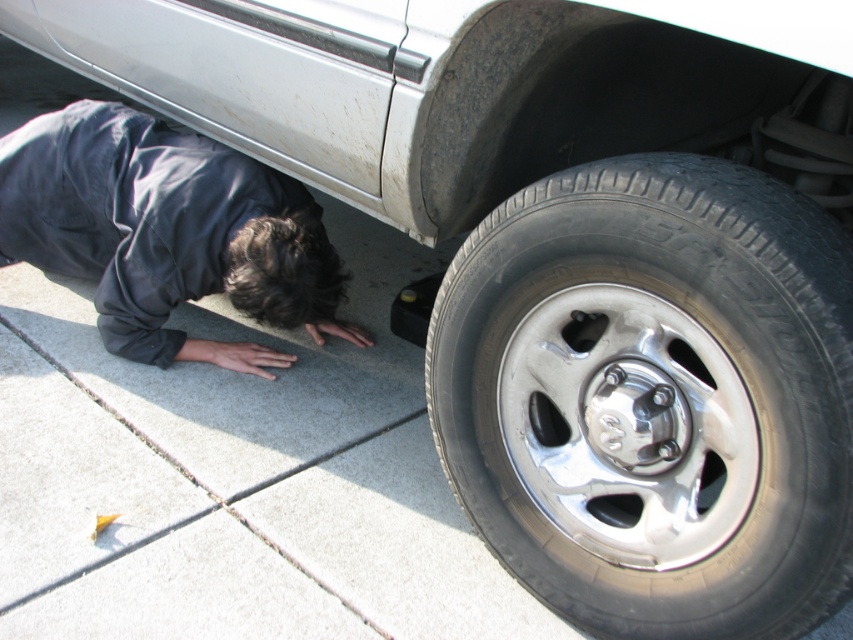
Is polished silver wheel at lower right bigger than silver metallic rim at lower right?

Yes, polished silver wheel at lower right is bigger than silver metallic rim at lower right.

Which is more to the left, polished silver wheel at lower right or silver metallic rim at lower right?

polished silver wheel at lower right

Image resolution: width=853 pixels, height=640 pixels. What do you see at coordinates (654, 397) in the screenshot? I see `polished silver wheel at lower right` at bounding box center [654, 397].

You are a GUI agent. You are given a task and a screenshot of the screen. Output one action in this format:
    pyautogui.click(x=<x>, y=<y>)
    Task: Click on the polished silver wheel at lower right
    Image resolution: width=853 pixels, height=640 pixels.
    Given the screenshot: What is the action you would take?
    pyautogui.click(x=654, y=397)

Which is more to the right, polished silver wheel at lower right or dark gray fabric at lower left?

Positioned to the right is polished silver wheel at lower right.

Which is above, polished silver wheel at lower right or dark gray fabric at lower left?

dark gray fabric at lower left is above.

Who is more forward, (699,337) or (265,192)?

Point (699,337)

I want to click on polished silver wheel at lower right, so click(x=654, y=397).

The height and width of the screenshot is (640, 853). Describe the element at coordinates (167, 232) in the screenshot. I see `dark gray fabric at lower left` at that location.

Can you confirm if dark gray fabric at lower left is positioned above silver metallic rim at lower right?

Yes.

Does point (38, 186) come behind point (601, 557)?

Yes, point (38, 186) is behind point (601, 557).

Find the location of a particular element. Image resolution: width=853 pixels, height=640 pixels. dark gray fabric at lower left is located at coordinates (167, 232).